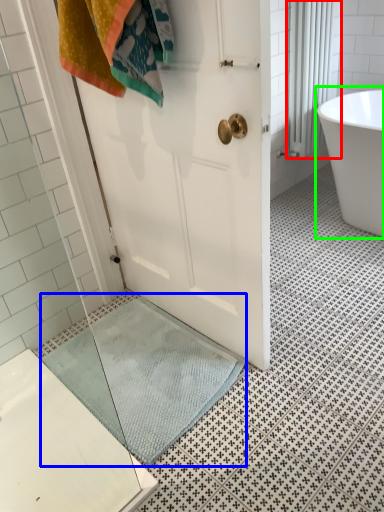
Question: Which is nearer to the shower curtain (highlighted by a red box)? bath mat (highlighted by a blue box) or bathtub (highlighted by a green box).

Choices:
 (A) bath mat
 (B) bathtub

Answer: (B)